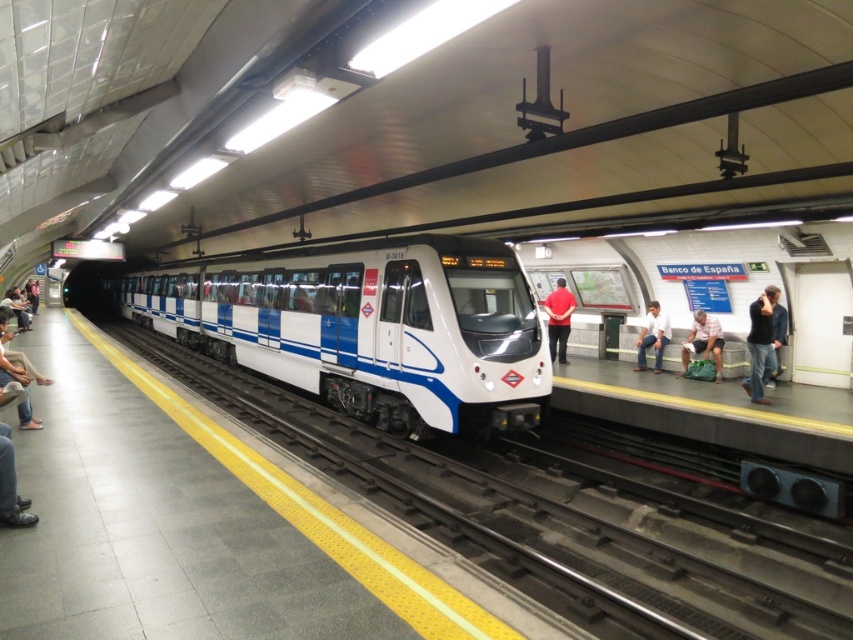
Can you confirm if denim jeans at left is positioned below white cotton shirt at center?

Indeed, denim jeans at left is positioned under white cotton shirt at center.

Which is more to the left, denim jeans at left or white cotton shirt at center?

denim jeans at left is more to the left.

The width and height of the screenshot is (853, 640). Describe the element at coordinates (10, 488) in the screenshot. I see `denim jeans at left` at that location.

Find the location of a particular element. This screenshot has width=853, height=640. denim jeans at left is located at coordinates (10, 488).

From the picture: Can you confirm if white metal train track at center is shorter than denim jeans at left?

No.

Can you confirm if white metal train track at center is wider than denim jeans at left?

Correct, the width of white metal train track at center exceeds that of denim jeans at left.

Describe the element at coordinates (509, 520) in the screenshot. I see `white metal train track at center` at that location.

Locate an element on the screen. The width and height of the screenshot is (853, 640). white metal train track at center is located at coordinates (x=509, y=520).

Is denim pants at lower left further to the viewer compared to white cotton shirt at center?

That is False.

Does point (33, 422) lie behind point (639, 362)?

No, it is not.

Who is more forward, (3,352) or (666,330)?

Positioned in front is point (3,352).

Image resolution: width=853 pixels, height=640 pixels. Identify the location of denim pants at lower left. (16, 376).